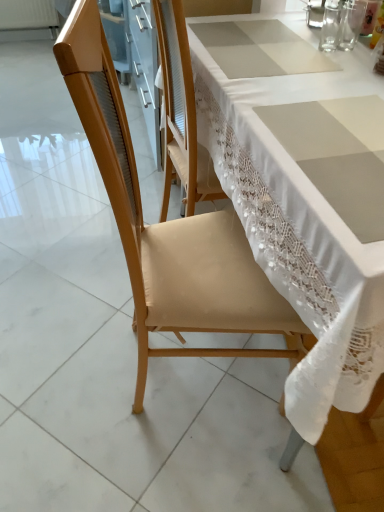
This screenshot has width=384, height=512. I want to click on free area behind clear glass at upper right, which appears as the 3th tableware when viewed from the right, so click(296, 23).